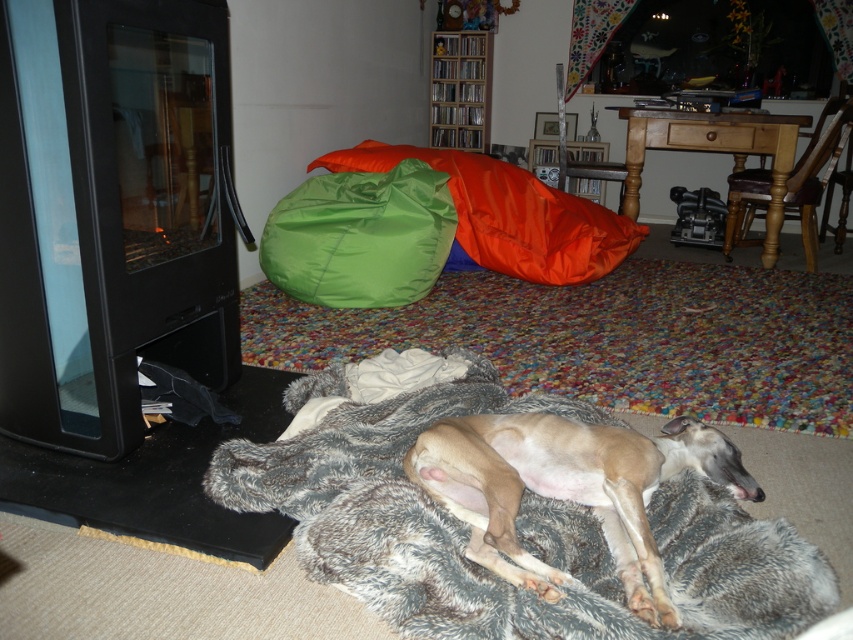
Which is in front, point (730, 531) or point (553, 449)?

Point (730, 531) is in front.

Between point (462, 573) and point (548, 458), which one is positioned in front?

Positioned in front is point (462, 573).

At what (x,y) coordinates should I click in order to perform the action: click on fuzzy gray dog bed at lower center. Please return your answer as a coordinate pair (x, y). This screenshot has height=640, width=853. Looking at the image, I should click on (515, 524).

Can you confirm if light brown fur at center is thinner than orange fabric bean bag at center?

In fact, light brown fur at center might be wider than orange fabric bean bag at center.

Who is higher up, light brown fur at center or orange fabric bean bag at center?

orange fabric bean bag at center is above.

Is point (498, 547) positioned in front of point (817, 148)?

That is True.

Find the location of a particular element. Image resolution: width=853 pixels, height=640 pixels. light brown fur at center is located at coordinates (567, 488).

In the scene shown: Is fuzzy gray dog bed at lower center closer to camera compared to orange fabric bean bag at center?

Yes, fuzzy gray dog bed at lower center is closer to the viewer.

Can you confirm if fuzzy gray dog bed at lower center is positioned above orange fabric bean bag at center?

No.

Based on the photo, who is more distant from viewer, (403, 604) or (817, 154)?

Point (817, 154)

Locate an element on the screen. fuzzy gray dog bed at lower center is located at coordinates (515, 524).